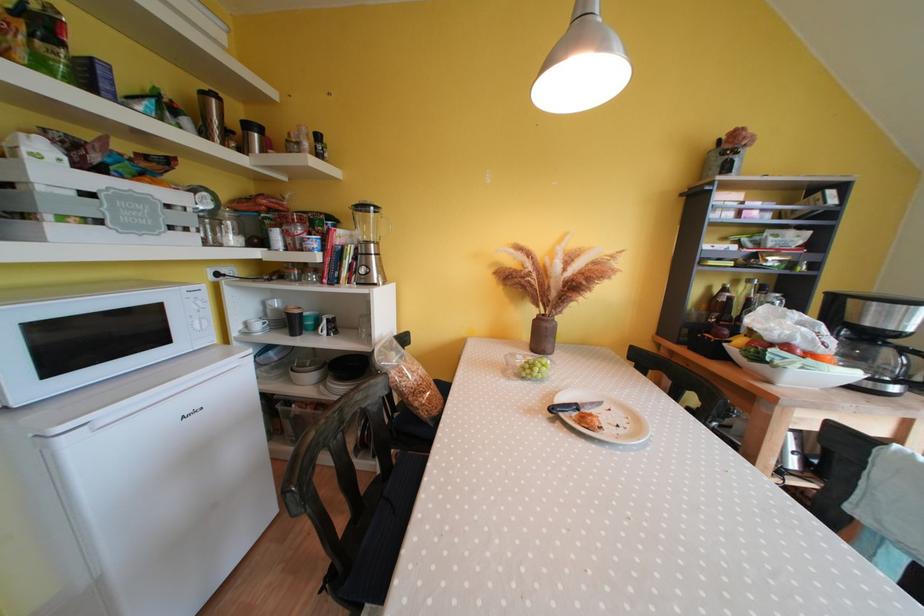
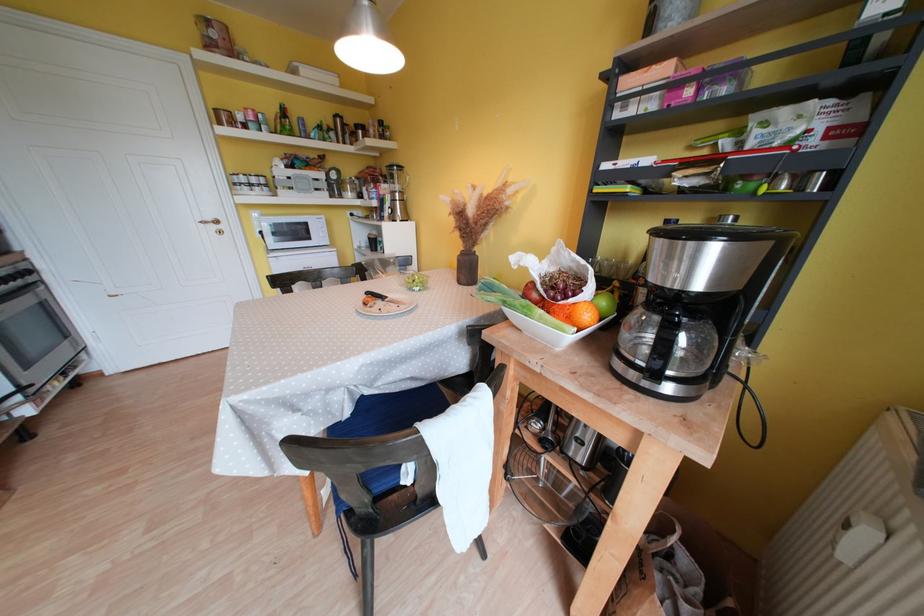
Find the pixel in the second image that matches (x=582, y=410) in the first image.

(390, 301)